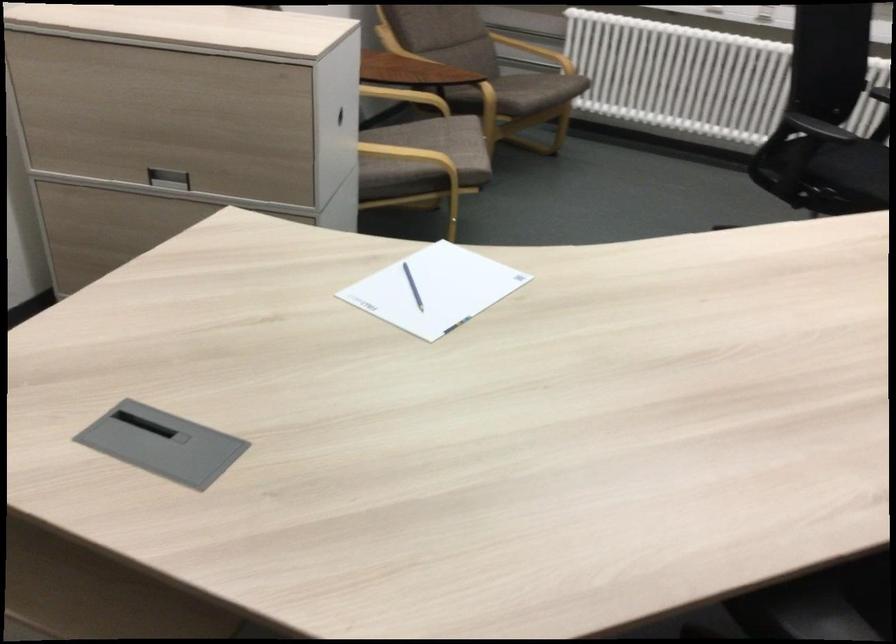
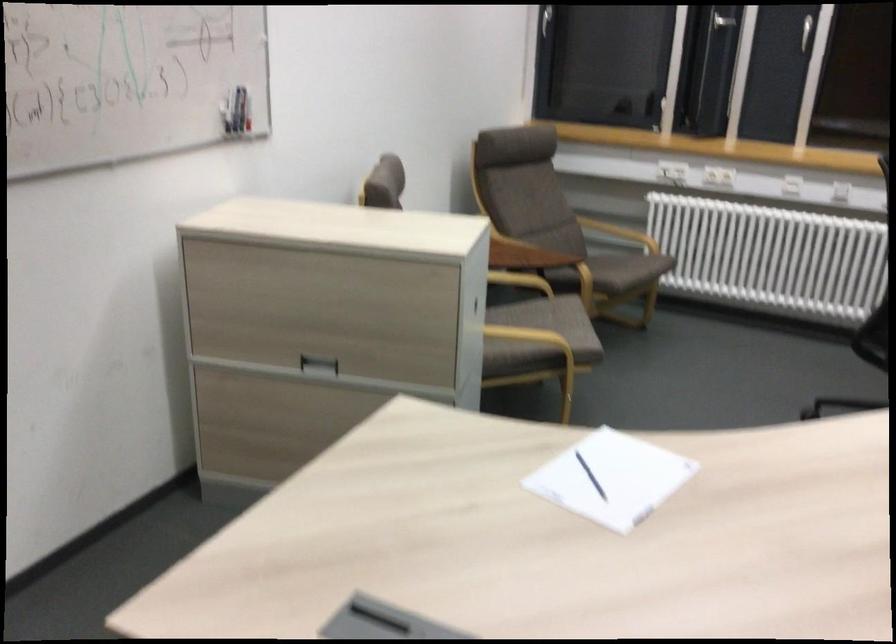
Which direction would the cameraman need to move to produce the second image?

The cameraman walked toward left, backward.